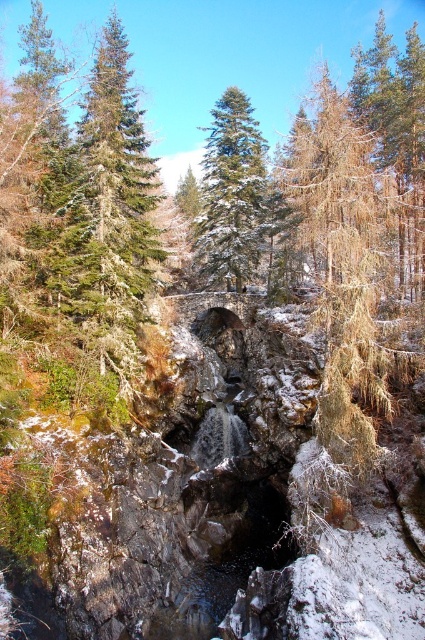
Between green textured pine tree at upper left and green matte evergreen tree at center, which one has less height?

Standing shorter between the two is green textured pine tree at upper left.

Based on the photo, can you confirm if green textured pine tree at upper left is positioned above green matte evergreen tree at center?

Incorrect, green textured pine tree at upper left is not positioned above green matte evergreen tree at center.

Identify the location of green textured pine tree at upper left. This screenshot has width=425, height=640. (118, 200).

The height and width of the screenshot is (640, 425). In order to click on green textured pine tree at upper left in this screenshot , I will do `click(118, 200)`.